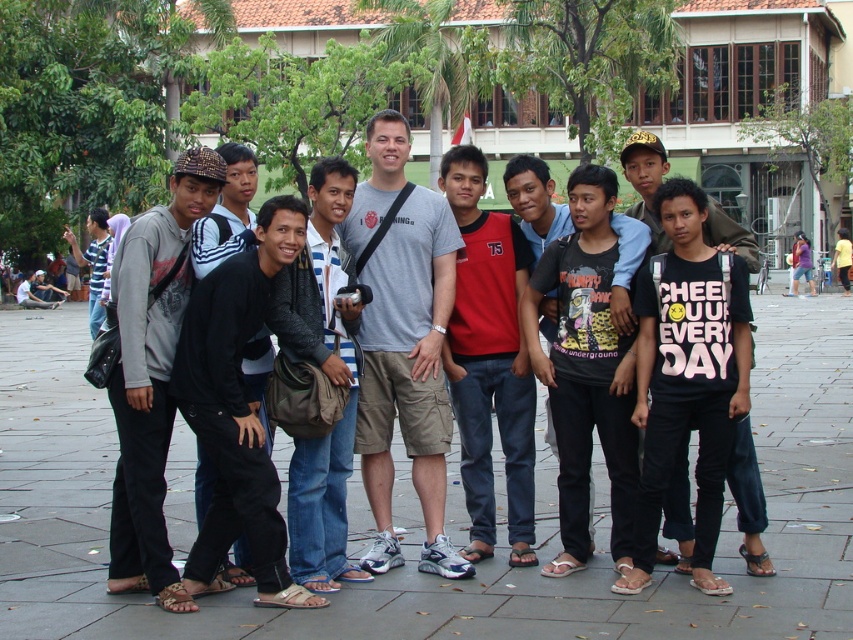
Question: Can you confirm if red cotton shirt at center is smaller than black cotton shirt at left?

Choices:
 (A) yes
 (B) no

Answer: (A)

Question: Which object is closer to the camera taking this photo?

Choices:
 (A) matte gray hoodie at left
 (B) leather jacket at center

Answer: (A)

Question: Which of the following is the closest to the observer?

Choices:
 (A) red cotton shirt at center
 (B) black matte jacket at center
 (C) black cotton shirt at left

Answer: (B)

Question: Does black matte shirt at center have a smaller size compared to black matte jacket at center?

Choices:
 (A) no
 (B) yes

Answer: (A)

Question: Which point is closer to the camera?

Choices:
 (A) black cotton t-shirt at center
 (B) black matte jacket at center
 (C) leather jacket at center

Answer: (B)

Question: From the image, what is the correct spatial relationship of black matte jacket at center in relation to leather jacket at center?

Choices:
 (A) above
 (B) below

Answer: (A)